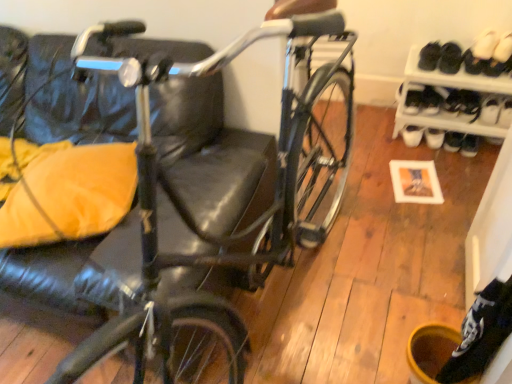
Find the location of a particular element. free spot above white plastic shoe rack at lower right (from a real-world perspective) is located at coordinates (454, 63).